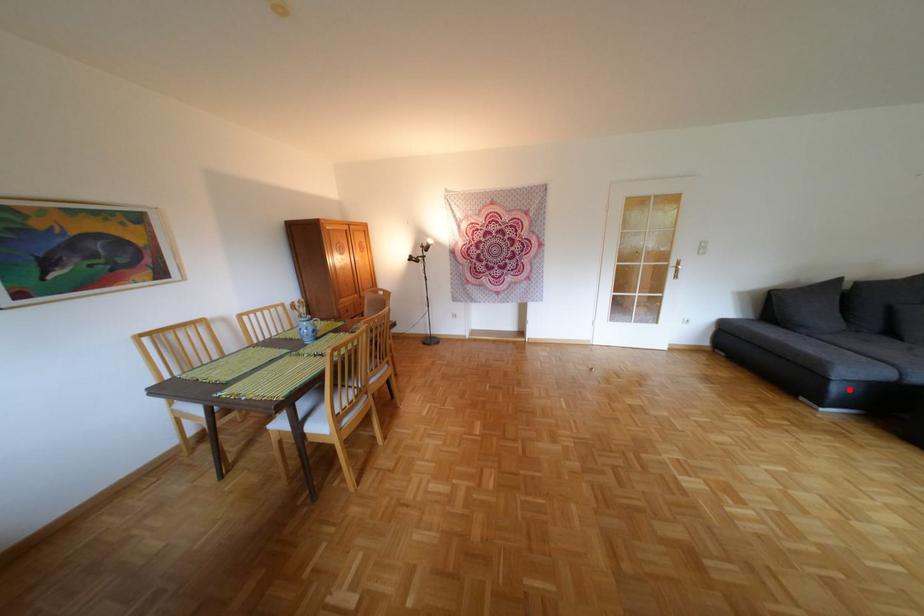
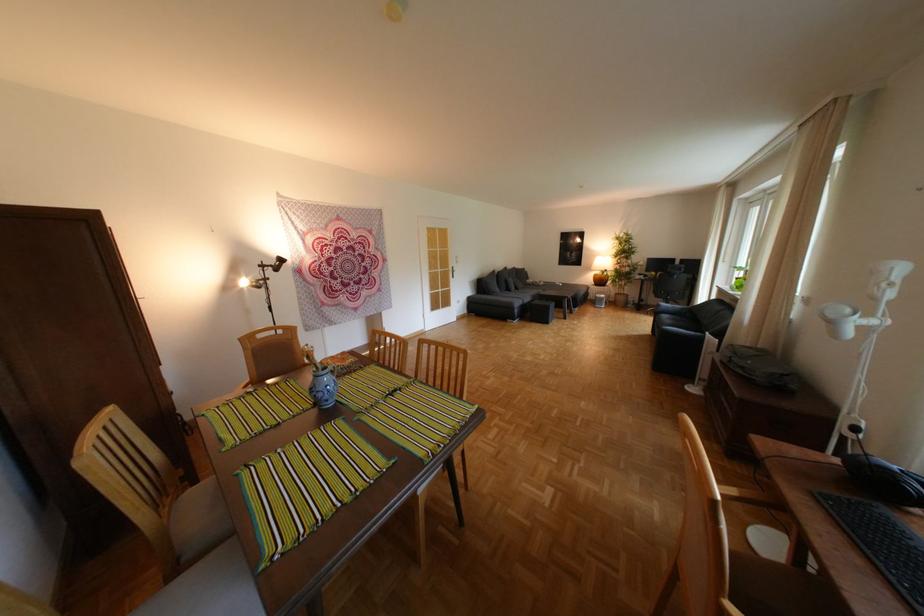
Where in the second image is the point corresponding to the highlighted location from the first image?

(529, 312)